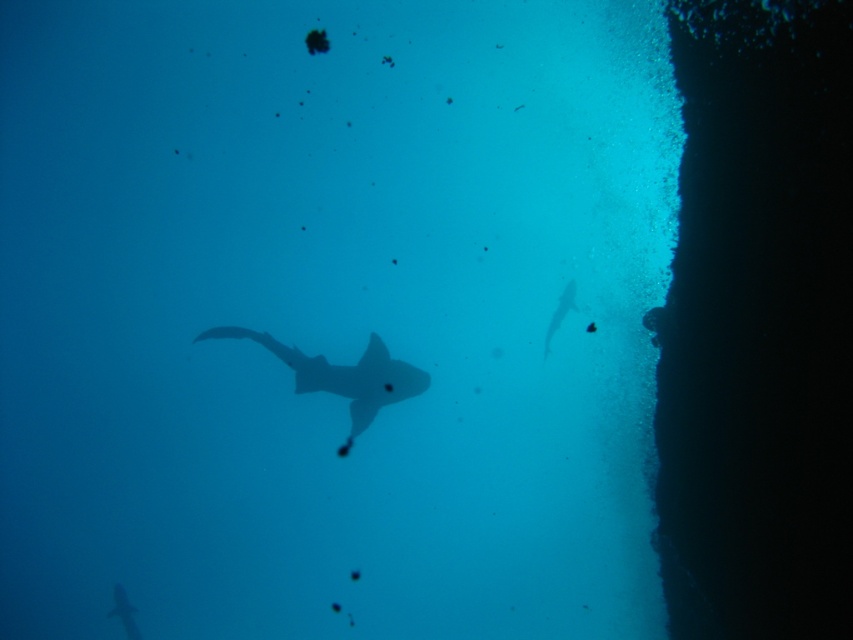
Can you confirm if translucent gray shark at center is wider than translucent gray fish at right?

Indeed, translucent gray shark at center has a greater width compared to translucent gray fish at right.

In the scene shown: Is the position of translucent gray shark at center less distant than that of translucent gray fish at right?

Yes.

Image resolution: width=853 pixels, height=640 pixels. Identify the location of translucent gray shark at center. (341, 376).

Locate an element on the screen. This screenshot has height=640, width=853. translucent gray shark at center is located at coordinates (341, 376).